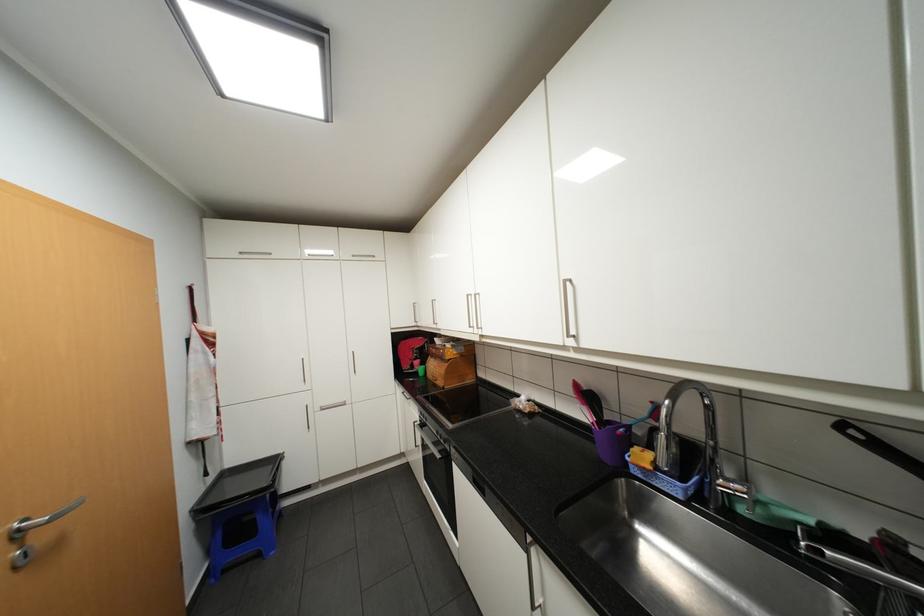
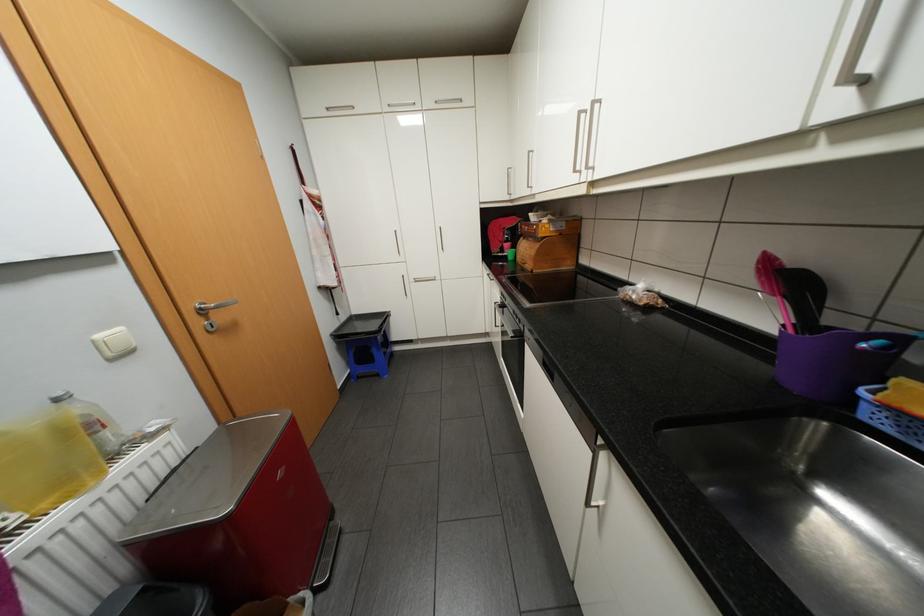
Find the pixel in the second image that matches (x=249, y=252) in the first image.

(335, 108)